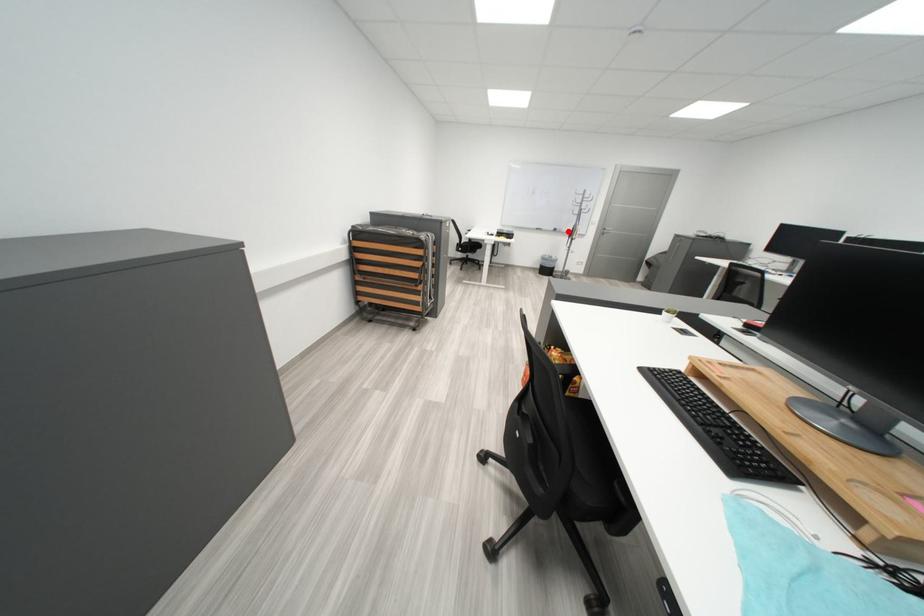
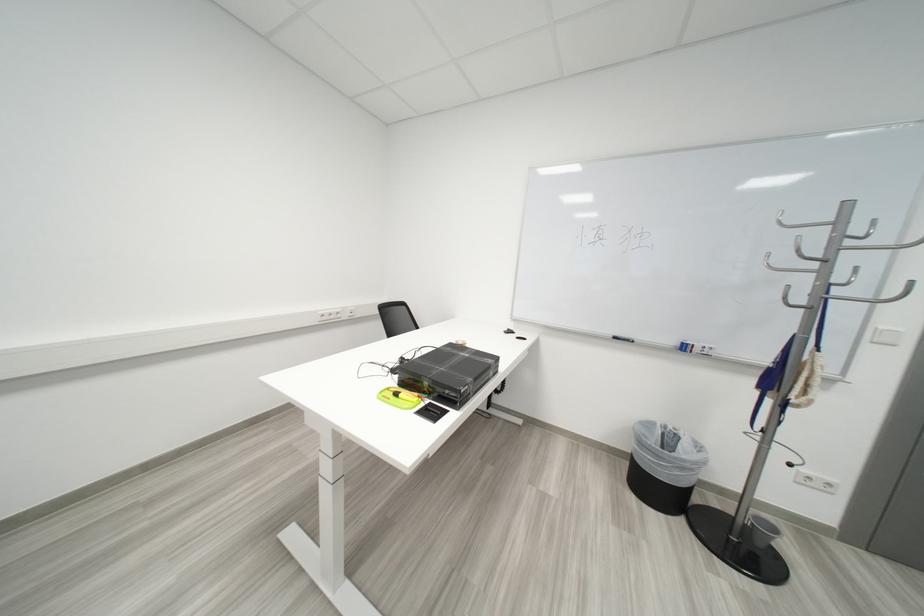
The point at the highlighted location is marked in the first image. Where is the corresponding point in the second image?

(698, 350)